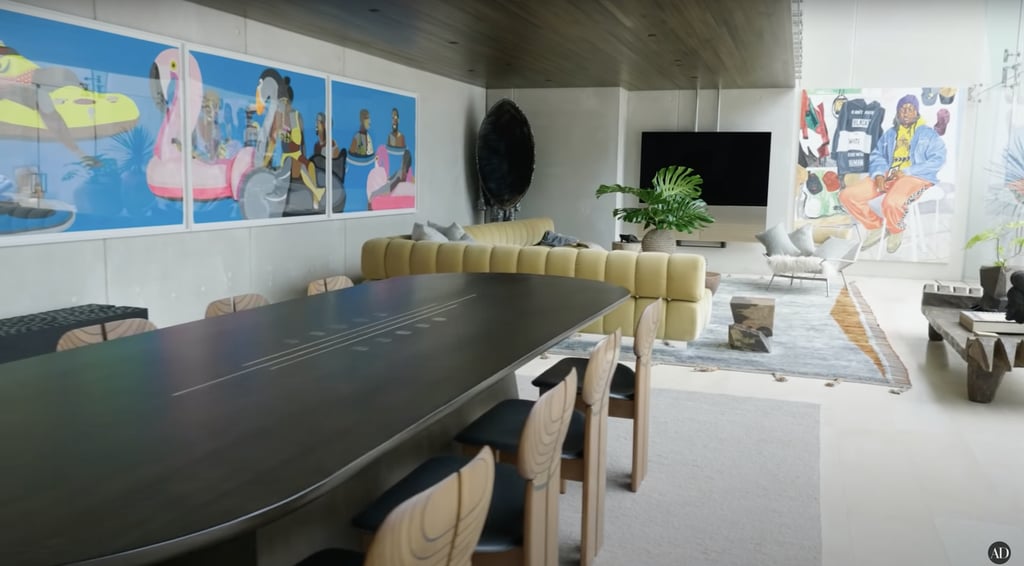
Identify the location of large black table. (282, 439).